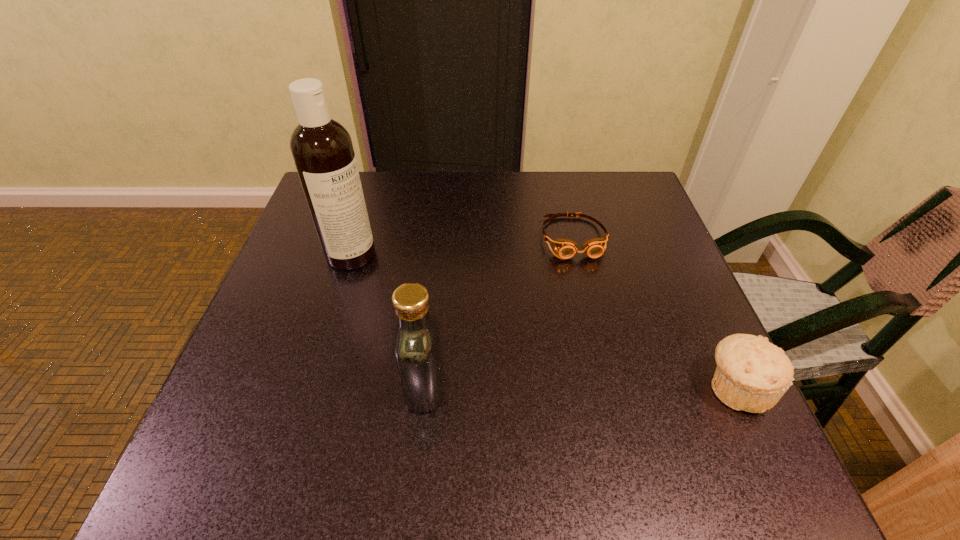
The width and height of the screenshot is (960, 540). What are the coordinates of `vodka` in the screenshot? It's located at (417, 349).

Where is `the second object from left to right`? The width and height of the screenshot is (960, 540). the second object from left to right is located at coordinates (417, 349).

The height and width of the screenshot is (540, 960). What are the coordinates of `the third tallest object` in the screenshot? It's located at (752, 374).

The image size is (960, 540). Identify the location of muffin. (752, 374).

Where is `the tallest object`? the tallest object is located at coordinates (322, 149).

The width and height of the screenshot is (960, 540). In order to click on the leftmost object in this screenshot , I will do `click(322, 149)`.

Locate an element on the screen. the shortest object is located at coordinates (565, 248).

Locate an element on the screen. Image resolution: width=960 pixels, height=540 pixels. goggles is located at coordinates (565, 248).

At what (x,y) coordinates should I click in order to perform the action: click on vacant space located 0.060m on the front-facing side of the third shortest object. Please return your answer as a coordinate pair (x, y). This screenshot has width=960, height=540. Looking at the image, I should click on (372, 387).

The width and height of the screenshot is (960, 540). Find the location of `vacant region located 0.190m on the front-facing side of the third shortest object`. vacant region located 0.190m on the front-facing side of the third shortest object is located at coordinates (299, 387).